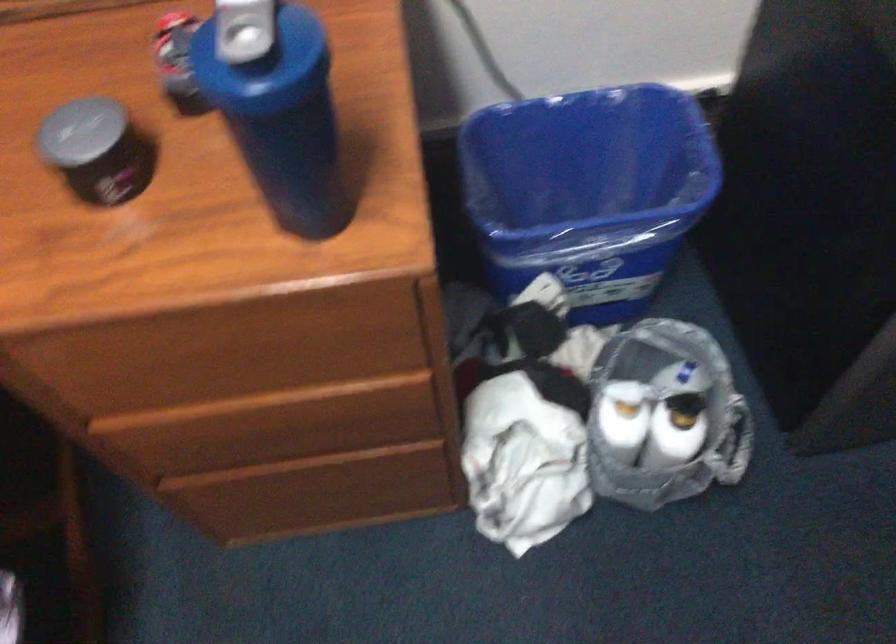
Identify the location of shaker bottle cap. The width and height of the screenshot is (896, 644). tap(264, 102).